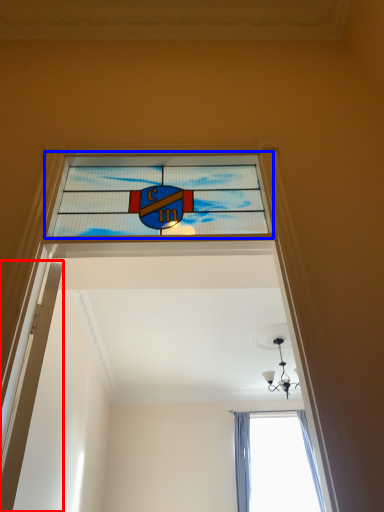
Question: Which of the following is the farthest to the observer, door (highlighted by a red box) or window (highlighted by a blue box)?

Choices:
 (A) door
 (B) window

Answer: (B)